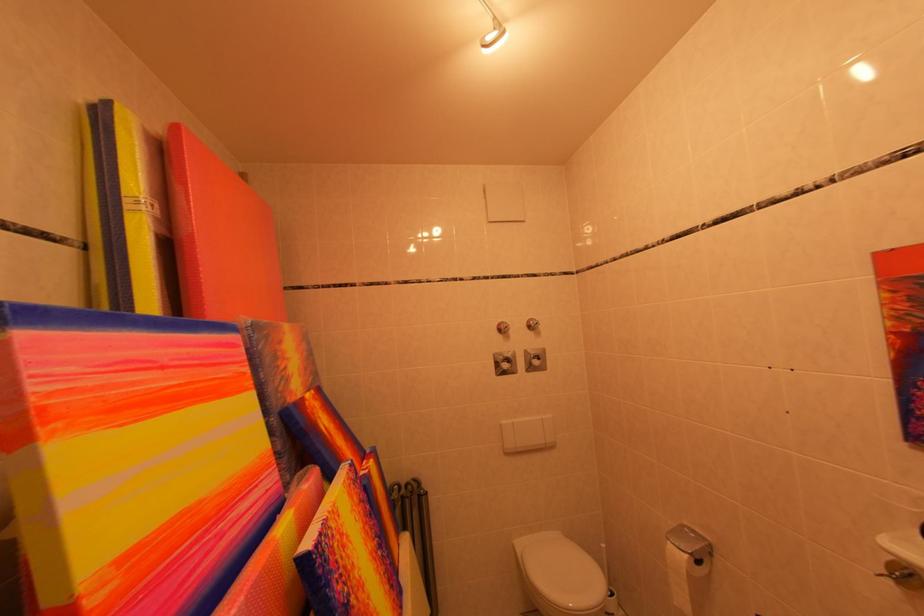
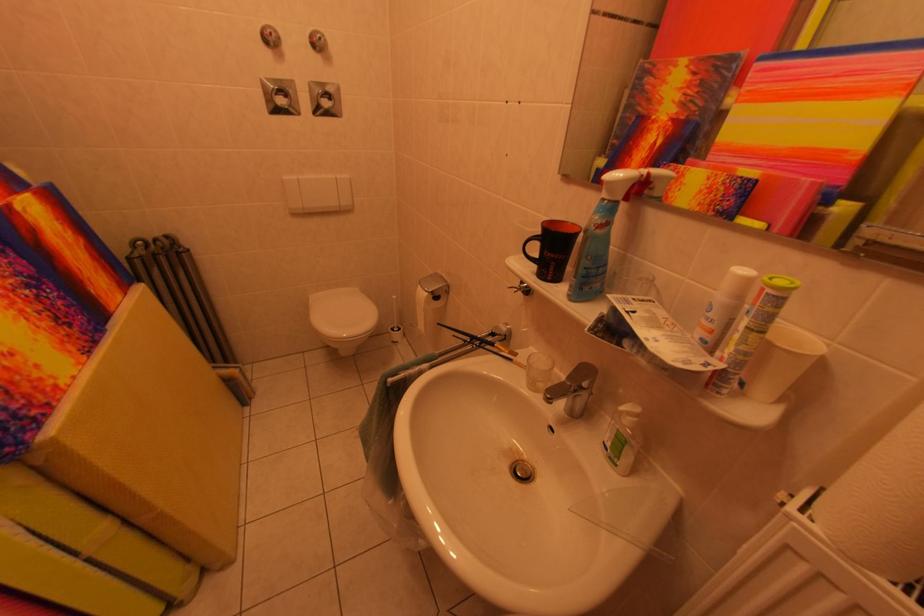
Find the pixel in the second image that matches [545,363] in the first image.

(334, 103)